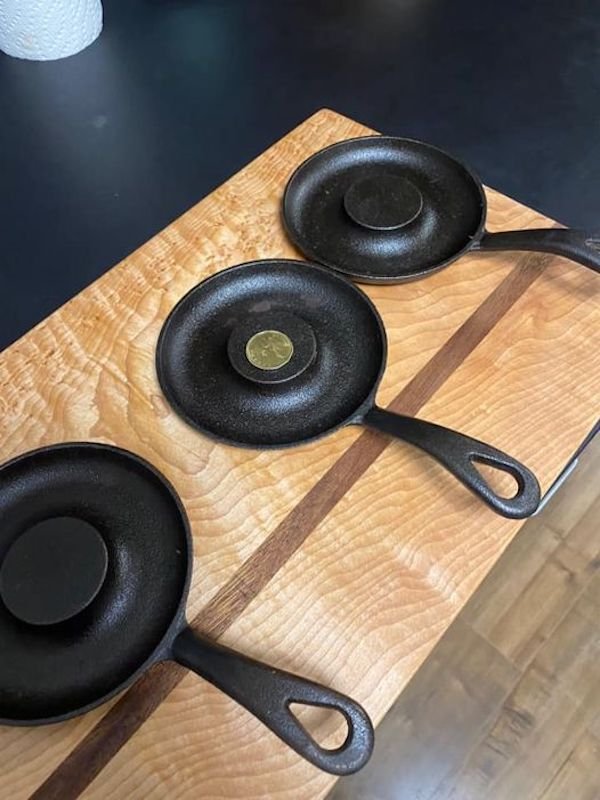
Identify the location of paper towel roll. (47, 14).